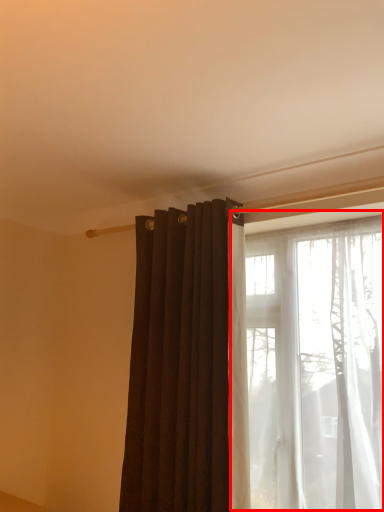
Question: From the image's perspective, where is window (annotated by the red box) located relative to curtain?

Choices:
 (A) above
 (B) below

Answer: (B)